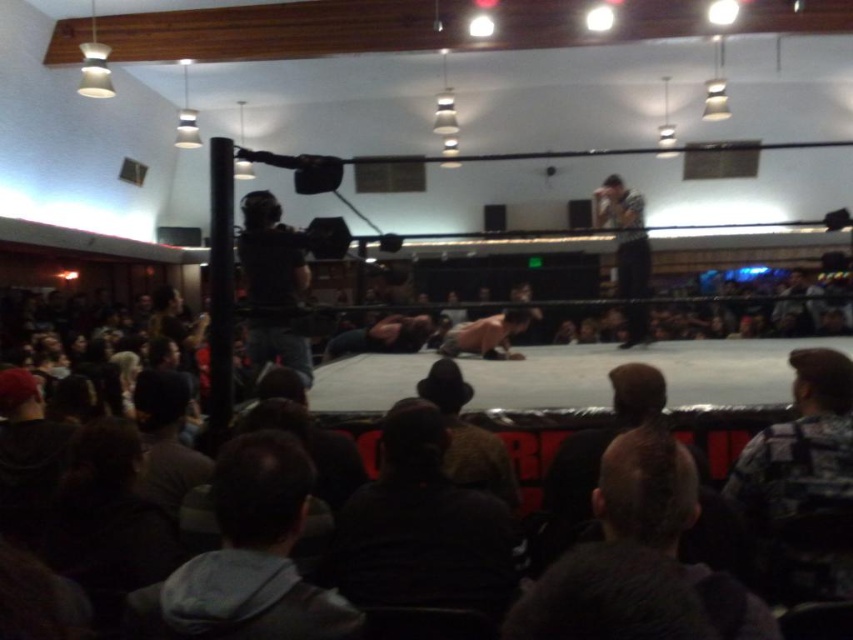
Who is lower down, dark gray hoodie at lower left or dark brown leather jacket at center?

Positioned lower is dark brown leather jacket at center.

Who is more forward, [241,634] or [469,451]?

Point [241,634]

At what (x,y) coordinates should I click in order to perform the action: click on dark gray hoodie at lower left. Please return your answer as a coordinate pair (x, y). This screenshot has height=640, width=853. Looking at the image, I should click on (247, 557).

Between point (270, 540) and point (641, 196), which one is positioned in front?

Point (270, 540) is more forward.

Is dark gray hoodie at lower left shorter than striped shirt at upper right?

Yes.

Who is more distant from viewer, (167,621) or (628,289)?

Point (628,289)

Locate an element on the screen. The image size is (853, 640). dark gray hoodie at lower left is located at coordinates (247, 557).

Can you confirm if dark gray hoodie at center is thinner than dark brown hair at center?

In fact, dark gray hoodie at center might be wider than dark brown hair at center.

Between dark gray hoodie at center and dark brown hair at center, which one has less height?

dark brown hair at center

This screenshot has height=640, width=853. Describe the element at coordinates (421, 528) in the screenshot. I see `dark gray hoodie at center` at that location.

The height and width of the screenshot is (640, 853). What are the coordinates of `dark gray hoodie at center` in the screenshot? It's located at (421, 528).